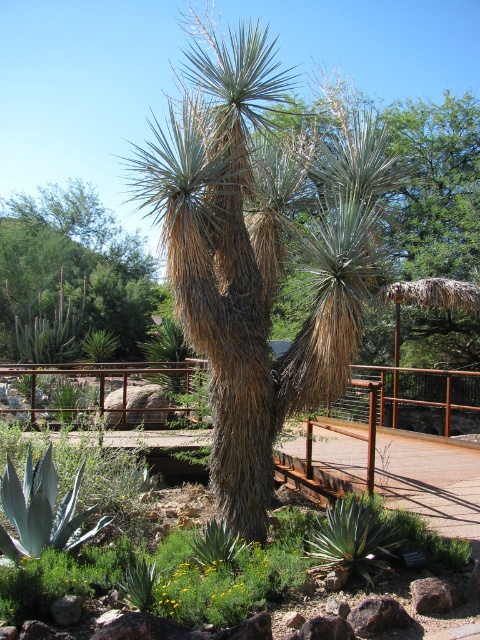
Question: Is green leafy tree at center above green leafy plants at center?

Choices:
 (A) yes
 (B) no

Answer: (A)

Question: Which of the following is the farthest from the observer?

Choices:
 (A) green leafy plants at center
 (B) gray rock at center

Answer: (A)

Question: Considering the relative positions of green leafy tree at center and green leafy plants at center in the image provided, where is green leafy tree at center located with respect to green leafy plants at center?

Choices:
 (A) right
 (B) left

Answer: (B)

Question: Which is farther from the gray rock at center?

Choices:
 (A) green leafy tree at center
 (B) green leafy plants at center

Answer: (A)

Question: Which point is closer to the camera?

Choices:
 (A) gray rock at center
 (B) green leafy plants at center

Answer: (A)

Question: Does green leafy tree at center appear on the left side of green leafy plants at center?

Choices:
 (A) no
 (B) yes

Answer: (B)